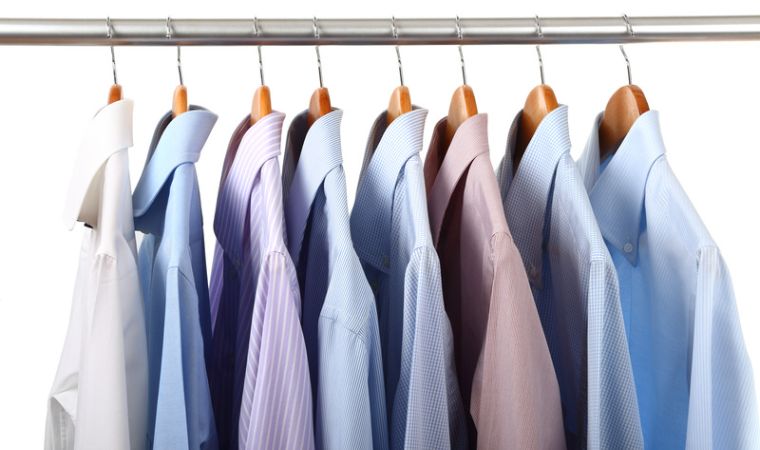
Image resolution: width=760 pixels, height=450 pixels. I want to click on space between hangers, so click(x=584, y=82), click(x=515, y=77), click(x=445, y=78), click(x=369, y=83), click(x=296, y=83), click(x=230, y=83), click(x=153, y=83).